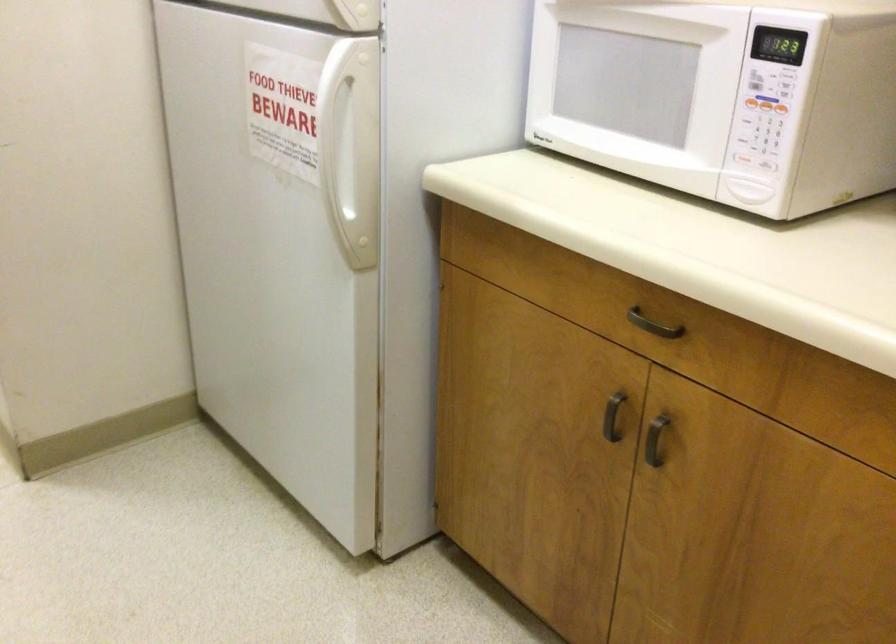
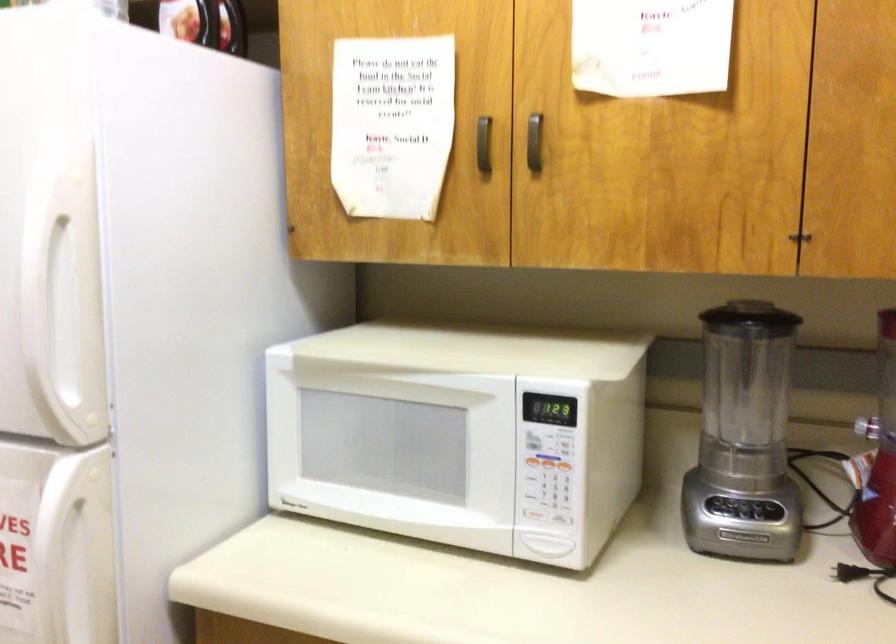
The point at (778, 104) is marked in the first image. Where is the corresponding point in the second image?

(565, 467)